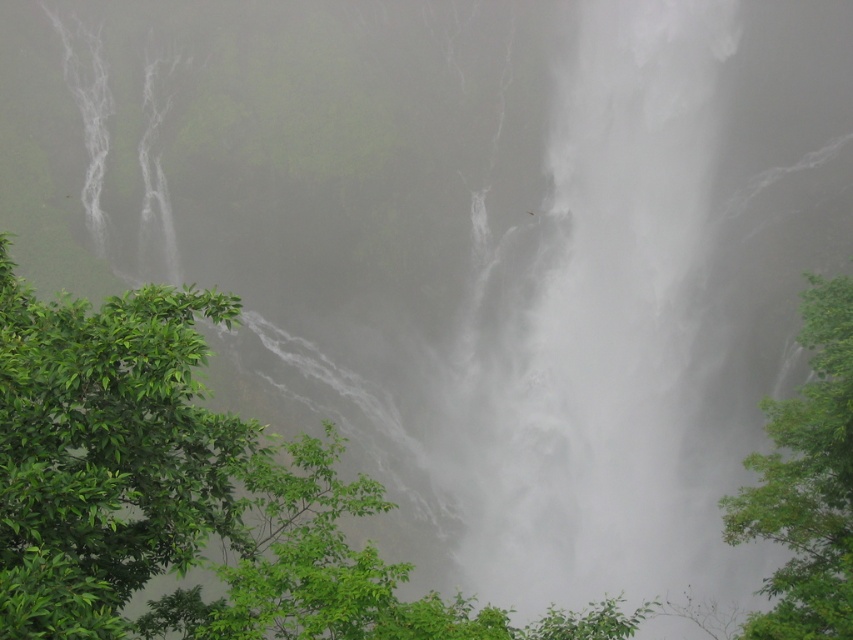
Question: Can you confirm if green leafy tree at left is positioned below green leafy tree at right?

Choices:
 (A) no
 (B) yes

Answer: (B)

Question: From the image, what is the correct spatial relationship of green leafy tree at left in relation to green leafy tree at right?

Choices:
 (A) below
 (B) above

Answer: (A)

Question: Does green leafy tree at left appear over green leafy tree at right?

Choices:
 (A) yes
 (B) no

Answer: (B)